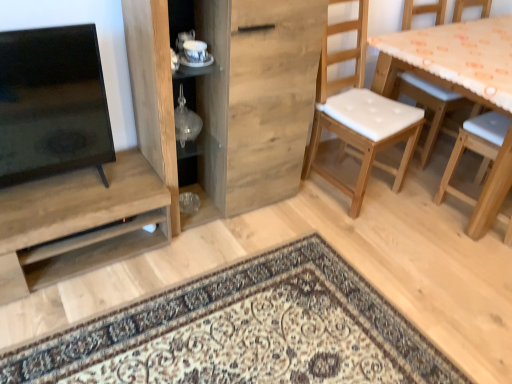
Question: Is wooden table with orange patterned cloth at right not near white padded wood chair at right?

Choices:
 (A) yes
 (B) no

Answer: (B)

Question: From the image's perspective, is wooden table with orange patterned cloth at right beneath white padded wood chair at right?

Choices:
 (A) yes
 (B) no

Answer: (A)

Question: From the image's perspective, does wooden table with orange patterned cloth at right appear higher than white padded wood chair at right?

Choices:
 (A) no
 (B) yes

Answer: (A)

Question: Does wooden table with orange patterned cloth at right contain white padded wood chair at right?

Choices:
 (A) yes
 (B) no

Answer: (B)

Question: Is wooden table with orange patterned cloth at right positioned before white padded wood chair at right?

Choices:
 (A) yes
 (B) no

Answer: (A)

Question: In terms of width, does transparent glass vase at center, acting as the first shelf starting from the top, look wider or thinner when compared to wooden cabinet at center?

Choices:
 (A) thin
 (B) wide

Answer: (A)

Question: From a real-world perspective, is transparent glass vase at center, which is the 2th shelf from left to right, positioned above or below wooden cabinet at center?

Choices:
 (A) below
 (B) above

Answer: (B)

Question: From the image's perspective, is transparent glass vase at center, which appears as the first shelf when viewed from the right, above or below wooden cabinet at center?

Choices:
 (A) above
 (B) below

Answer: (B)

Question: Is point (184, 140) closer or farther from the camera than point (130, 13)?

Choices:
 (A) farther
 (B) closer

Answer: (A)

Question: From the image's perspective, is wooden cabinet at center located above or below matte wood shelf at left, the 2th shelf from the right?

Choices:
 (A) below
 (B) above

Answer: (B)

Question: Is wooden cabinet at center wider or thinner than matte wood shelf at left, arranged as the 2th shelf when viewed from the top?

Choices:
 (A) thin
 (B) wide

Answer: (A)

Question: Does point (312, 69) appear closer or farther from the camera than point (89, 190)?

Choices:
 (A) closer
 (B) farther

Answer: (B)

Question: From a real-world perspective, is wooden cabinet at center positioned above or below matte wood shelf at left, the 2th shelf from the right?

Choices:
 (A) above
 (B) below

Answer: (A)

Question: Is transparent glass vase at center, acting as the first shelf starting from the top, inside the boundaries of matte wood shelf at left, the 2th shelf from the right, or outside?

Choices:
 (A) inside
 (B) outside

Answer: (B)

Question: Is transparent glass vase at center, acting as the first shelf starting from the top, bigger or smaller than matte wood shelf at left, placed as the 1th shelf when sorted from bottom to top?

Choices:
 (A) small
 (B) big

Answer: (A)